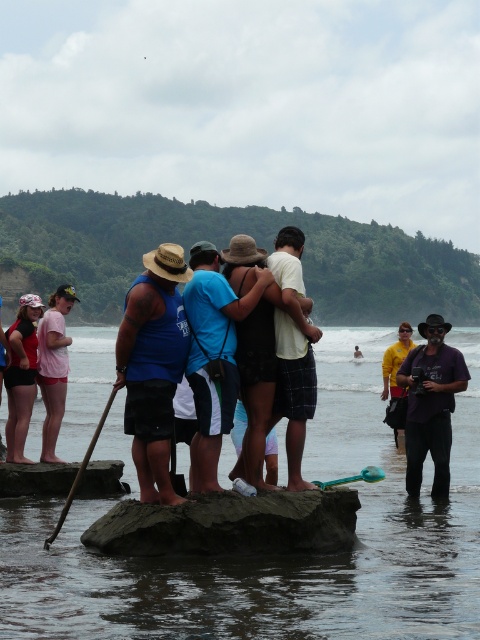
You are a photographer standing at the camera position. You want to take a photo of both point (163, 544) and point (422, 404). Which point will appear larger in your photo?

Point (163, 544) is closer to the camera than point (422, 404), so it will appear larger in the photo.